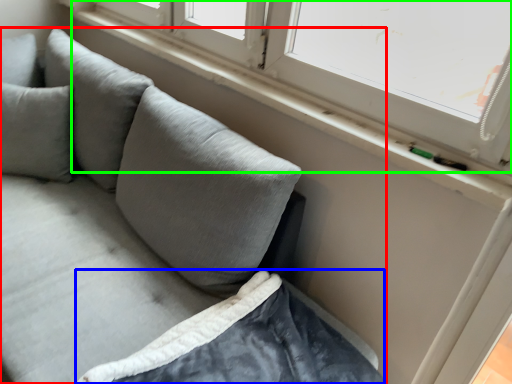
Question: Considering the real-world distances, which object is farthest from studio couch (highlighted by a red box)? sheet (highlighted by a blue box) or window (highlighted by a green box)?

Choices:
 (A) sheet
 (B) window

Answer: (B)